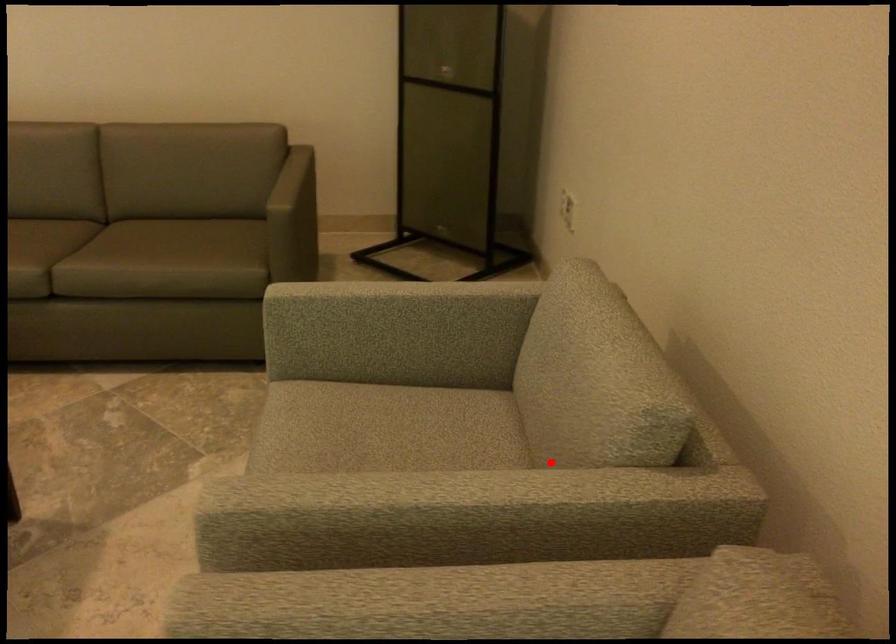
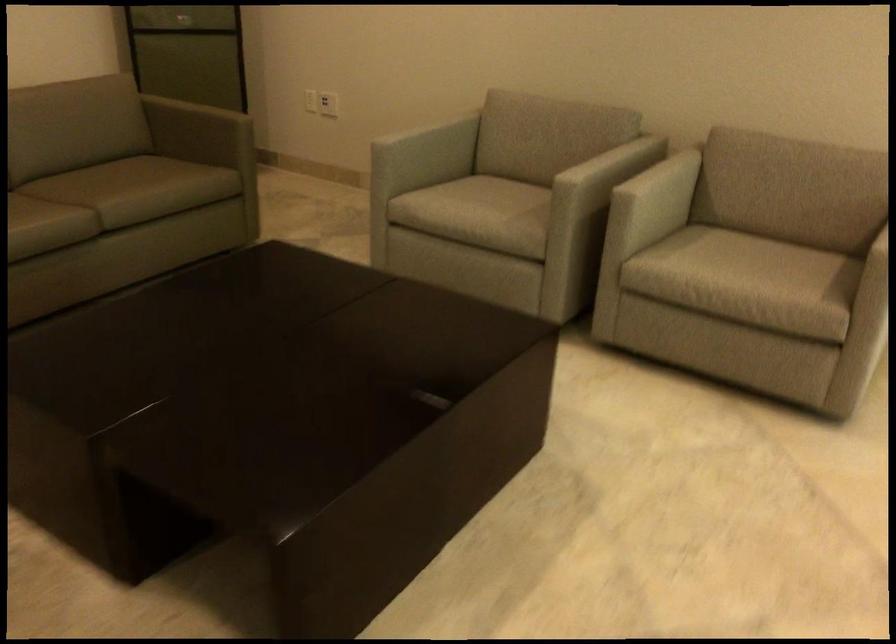
Question: I am providing you with two images of the same scene from different viewpoints. In image1, a red point is highlighted. Considering the same 3D point in image2, which of the following is correct?

Choices:
 (A) It is closer
 (B) It is farther

Answer: (B)